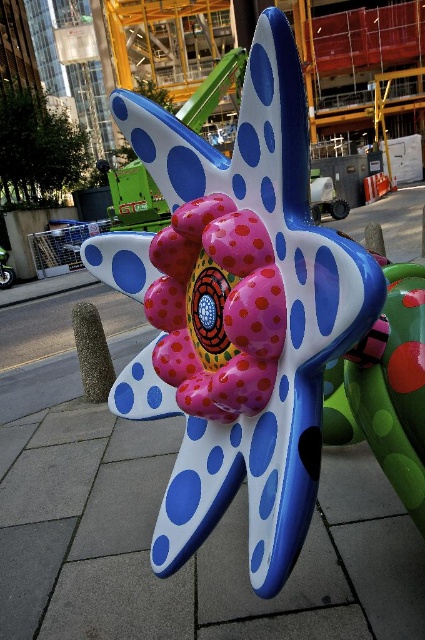
You are an artist planning to paint a mural inspired by the sculpture. You want to ensure the glossy plastic starfish at center and the pink glossy flower at center are proportionally accurate. Which object should you make wider in your design?

The glossy plastic starfish at center should be made wider in the design since its width is larger than the pink glossy flower at center according to the description.

You are an urban planner reviewing the sculpture design. The city requires that all central elements must be elevated for visibility. Given the glossy plastic starfish at center and the pink glossy flower at center, which one is positioned lower and might need adjustment?

The glossy plastic starfish at center is positioned below the pink glossy flower at center, so it is lower and might need adjustment.